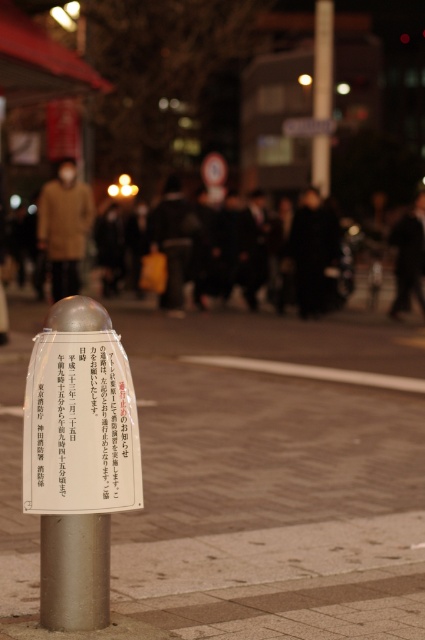
Consider the image. Does silver metallic pole at lower center come behind dark gray fabric crowd at center?

No.

Between point (334, 451) and point (342, 256), which one is positioned behind?

Positioned behind is point (342, 256).

Find the location of a particular element. The height and width of the screenshot is (640, 425). silver metallic pole at lower center is located at coordinates (246, 484).

Between point (142, 237) and point (286, 368), which one is positioned in front?

Point (286, 368) is more forward.

In the scene shown: Can you confirm if dark gray fabric crowd at center is positioned to the left of brown smooth curb at lower center?

In fact, dark gray fabric crowd at center is to the right of brown smooth curb at lower center.

This screenshot has width=425, height=640. What are the coordinates of `dark gray fabric crowd at center` in the screenshot? It's located at (362, 269).

Where is `dark gray fabric crowd at center`? The width and height of the screenshot is (425, 640). dark gray fabric crowd at center is located at coordinates (362, 269).

Does black paper sign at center have a lesser height compared to brown woolen coat at center?

Yes, black paper sign at center is shorter than brown woolen coat at center.

The image size is (425, 640). What do you see at coordinates (79, 426) in the screenshot?
I see `black paper sign at center` at bounding box center [79, 426].

Measure the distance between point [104,406] and camera.

11.37 feet

Identify the location of black paper sign at center. (79, 426).